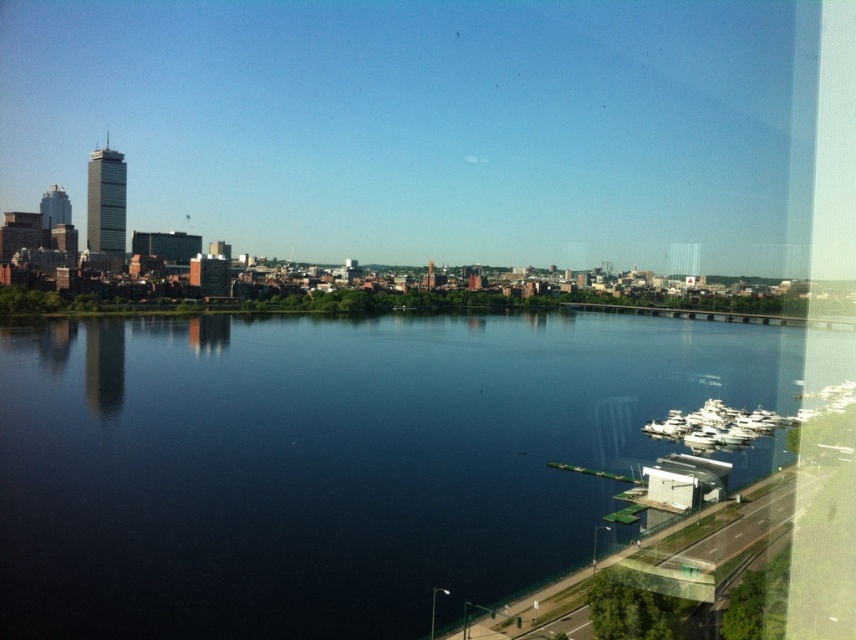
Question: Observing the image, what is the correct spatial positioning of dark blue water at center in reference to white glossy boats at lower right?

Choices:
 (A) left
 (B) right

Answer: (A)

Question: Does dark blue water at center have a larger size compared to white glossy boats at lower right?

Choices:
 (A) no
 (B) yes

Answer: (B)

Question: Among these points, which one is nearest to the camera?

Choices:
 (A) (764, 432)
 (B) (290, 417)

Answer: (B)

Question: Is dark blue water at center smaller than white glossy boats at lower right?

Choices:
 (A) no
 (B) yes

Answer: (A)

Question: Which of the following is the farthest from the observer?

Choices:
 (A) (687, 429)
 (B) (616, 442)

Answer: (A)

Question: Which point is farther to the camera?

Choices:
 (A) [678, 435]
 (B) [533, 406]

Answer: (B)